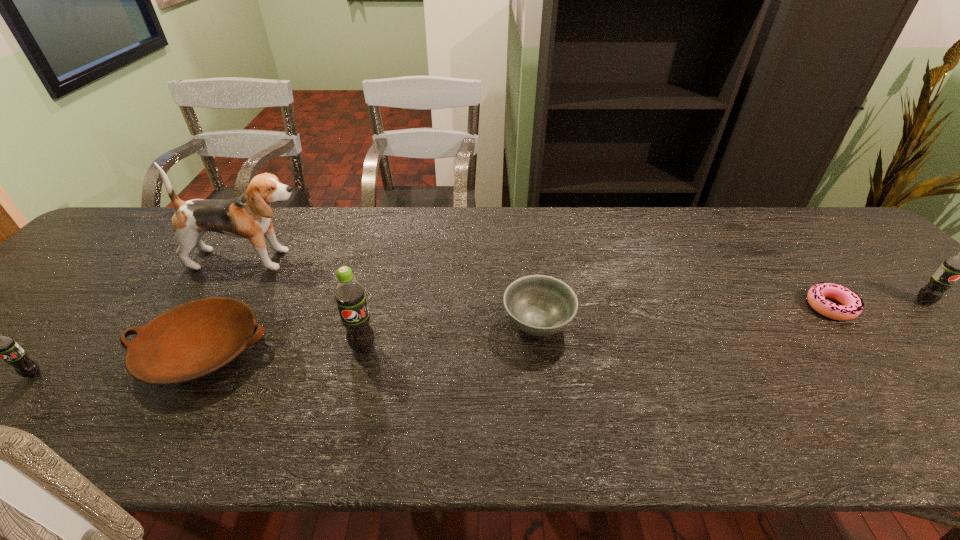
I want to click on the second object from right to left, so click(852, 307).

Locate an element on the screen. This screenshot has height=540, width=960. the shortest object is located at coordinates (852, 307).

I want to click on plate, so click(x=195, y=339).

Identify the location of vacant space situated on the front label of the rightmost object. (950, 326).

Identify the location of free space located 0.080m at the face of the farthest object. (342, 259).

You are a GUI agent. You are given a task and a screenshot of the screen. Output one action in this format:
    pyautogui.click(x=<x>, y=<y>)
    Task: Click on the blank area located 0.100m on the right of the third object from right to left
    The image size is (960, 540).
    Given the screenshot: What is the action you would take?
    pyautogui.click(x=615, y=323)

Find the location of a particular element. blank space located 0.350m on the left of the doughnut is located at coordinates (665, 307).

Where is `vacant point located on the left of the plate`? vacant point located on the left of the plate is located at coordinates (41, 352).

Locate an element on the screen. The image size is (960, 540). object present at the far edge is located at coordinates pos(248,216).

Image resolution: width=960 pixels, height=540 pixels. I want to click on soda that is at the near edge, so coord(5,347).